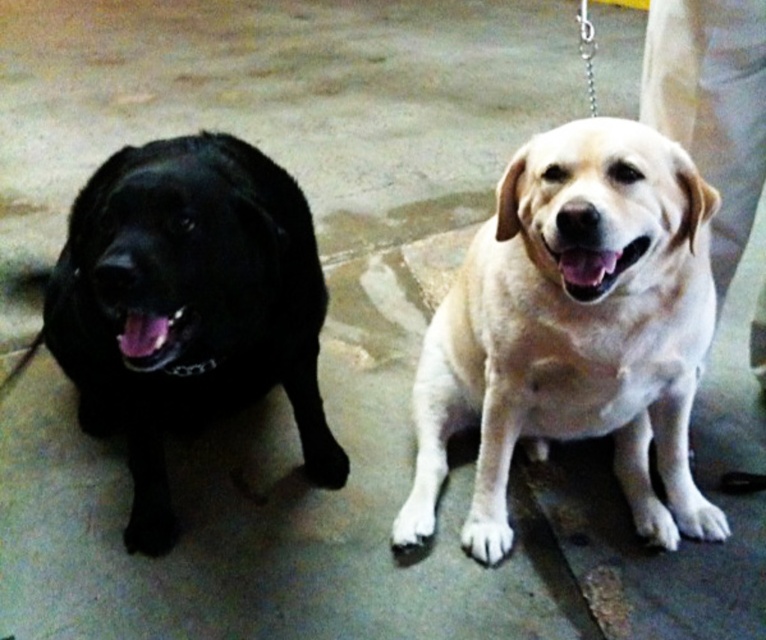
Looking at this image, you are a dog trainer assessing the height of the dogs in the image. Which dog is shorter between the light beige fur dog at center and the matte black dog at left?

The light beige fur dog at center is shorter than the matte black dog at left.

You are a dog trainer who needs to separate these two dogs using a divider that is 20 inches wide. Can the divider fit between the light beige fur dog at center and the matte black dog at left without touching either of them?

The light beige fur dog at center is 20.15 inches from the matte black dog at left. Since the divider is 20 inches wide, it can fit between them without touching either dog.